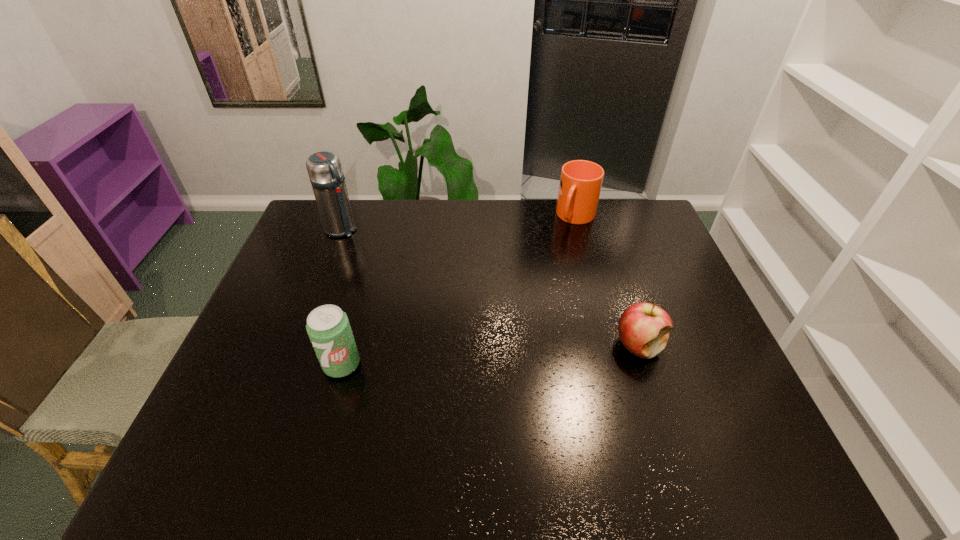
Where is `free spot between the mug and the apple`? free spot between the mug and the apple is located at coordinates (608, 281).

Where is `free spot between the soda and the mug`? free spot between the soda and the mug is located at coordinates (459, 291).

Locate an element on the screen. The image size is (960, 540). unoccupied area between the mug and the second object from left to right is located at coordinates (459, 291).

At what (x,y) coordinates should I click in order to perform the action: click on object that is the closest one to the apple. Please return your answer as a coordinate pair (x, y). Looking at the image, I should click on 580,185.

Select which object is the closest to the thermos bottle. Please provide its 2D coordinates. Your answer should be formatted as a tuple, i.e. [(x, y)], where the tuple contains the x and y coordinates of a point satisfying the conditions above.

[(328, 327)]

This screenshot has height=540, width=960. In order to click on vacant space that satisfies the following two spatial constraints: 1. on the back side of the mug; 2. on the left side of the soda in this screenshot , I will do `click(382, 217)`.

The image size is (960, 540). Find the location of `vacant space that satisfies the following two spatial constraints: 1. on the front side of the thermos bottle; 2. on the right side of the apple`. vacant space that satisfies the following two spatial constraints: 1. on the front side of the thermos bottle; 2. on the right side of the apple is located at coordinates (297, 346).

Locate an element on the screen. free region that satisfies the following two spatial constraints: 1. on the front side of the tallest object; 2. on the left side of the soda is located at coordinates (290, 364).

You are a GUI agent. You are given a task and a screenshot of the screen. Output one action in this format:
    pyautogui.click(x=<x>, y=<y>)
    Task: Click on the vacant point that satisfies the following two spatial constraints: 1. on the back side of the shortest object; 2. on the right side of the soda
    The image size is (960, 540).
    Given the screenshot: What is the action you would take?
    pyautogui.click(x=347, y=346)